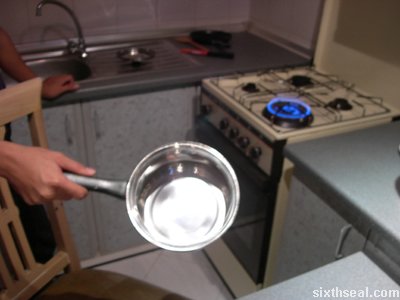
Identify the location of pot lid. The width and height of the screenshot is (400, 300). (134, 55).